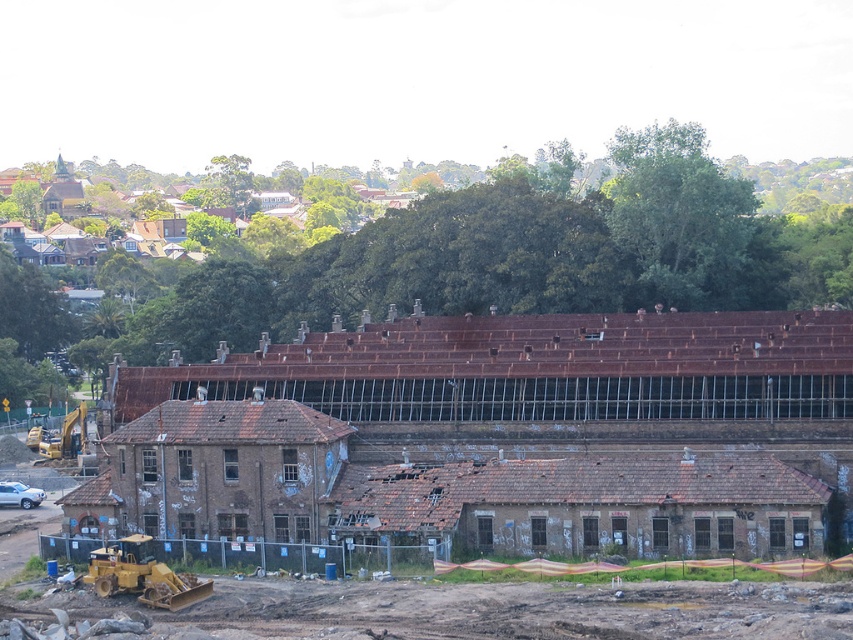
Who is shorter, yellow rubber bulldozer at lower left or yellow metallic excavator at lower left?

yellow rubber bulldozer at lower left is shorter.

Does yellow rubber bulldozer at lower left have a greater width compared to yellow metallic excavator at lower left?

No, yellow rubber bulldozer at lower left is not wider than yellow metallic excavator at lower left.

The width and height of the screenshot is (853, 640). Describe the element at coordinates (142, 573) in the screenshot. I see `yellow rubber bulldozer at lower left` at that location.

The height and width of the screenshot is (640, 853). Find the location of `yellow rubber bulldozer at lower left`. yellow rubber bulldozer at lower left is located at coordinates (142, 573).